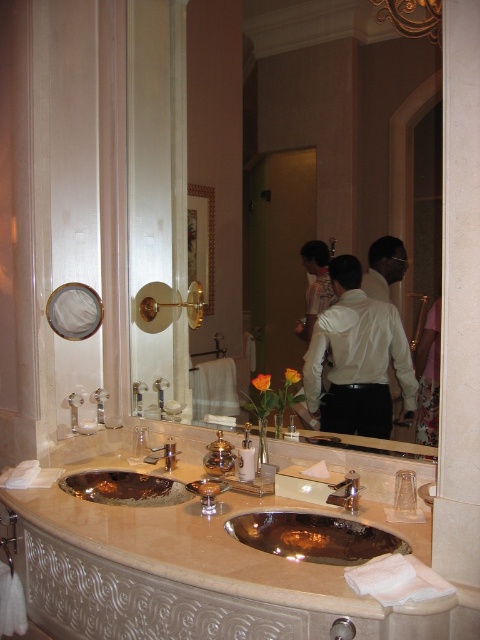
Can you confirm if metallic polished sink at center is positioned to the left of brushed metal faucet at center?

Correct, you'll find metallic polished sink at center to the left of brushed metal faucet at center.

Does metallic polished sink at center appear on the right side of brushed metal faucet at center?

In fact, metallic polished sink at center is to the left of brushed metal faucet at center.

Is point (326, 528) closer to viewer compared to point (336, 499)?

Yes, point (326, 528) is closer to viewer.

You are a GUI agent. You are given a task and a screenshot of the screen. Output one action in this format:
    pyautogui.click(x=<x>, y=<y>)
    Task: Click on the metallic polished sink at center
    The width and height of the screenshot is (480, 640).
    Given the screenshot: What is the action you would take?
    pyautogui.click(x=313, y=536)

Measure the distance between point (385, 81) and camera.

A distance of 1.73 meters exists between point (385, 81) and camera.

Can you confirm if gold metallic mirror at center is positioned to the left of metallic polished sink at center?

Yes, gold metallic mirror at center is to the left of metallic polished sink at center.

I want to click on gold metallic mirror at center, so click(328, 141).

From the picture: Which of these two, gold metallic mirror at center or brushed metal faucet at center, stands shorter?

With less height is brushed metal faucet at center.

Does gold metallic mirror at center lie in front of brushed metal faucet at center?

Yes.

Where is `gold metallic mirror at center`? gold metallic mirror at center is located at coordinates (328, 141).